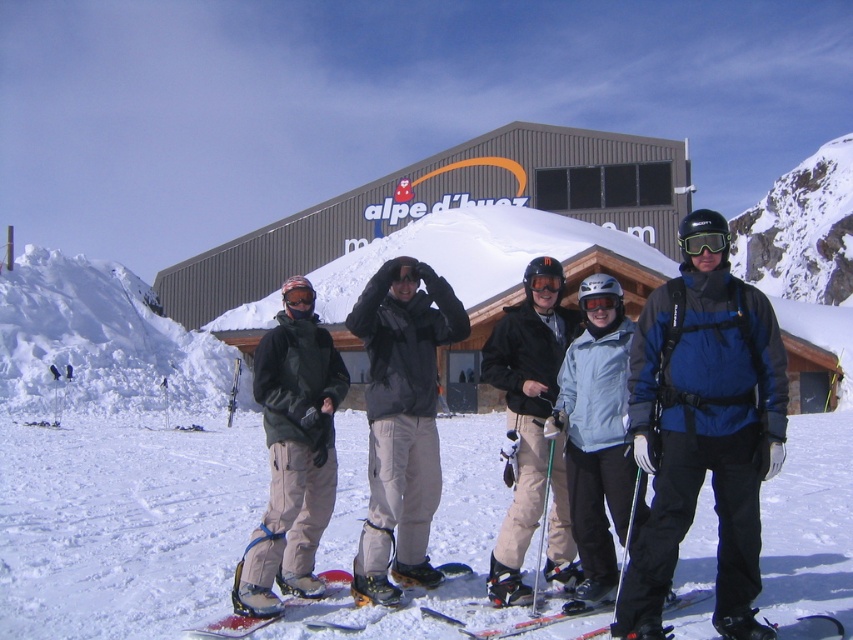
Question: Can you confirm if dark gray fleece jacket at center is bigger than shiny metallic ski at center?

Choices:
 (A) no
 (B) yes

Answer: (B)

Question: Considering the real-world distances, which object is farthest from the light blue fabric jacket at center?

Choices:
 (A) shiny metallic ski at center
 (B) blue matte jacket at center
 (C) dark gray fleece jacket at center

Answer: (C)

Question: Which of the following is the closest to the observer?

Choices:
 (A) shiny metallic ski at center
 (B) dark gray fleece jacket at center
 (C) light blue fabric jacket at center
 (D) black matte ski goggles at center

Answer: (A)

Question: Among these objects, which one is farthest from the camera?

Choices:
 (A) shiny metallic ski at center
 (B) black matte goggles at center

Answer: (B)

Question: Does metallic gray building at center appear on the right side of shiny orange ski at center?

Choices:
 (A) yes
 (B) no

Answer: (B)

Question: In this image, where is shiny orange ski at center located relative to orange reflective goggles at center?

Choices:
 (A) below
 (B) above

Answer: (A)